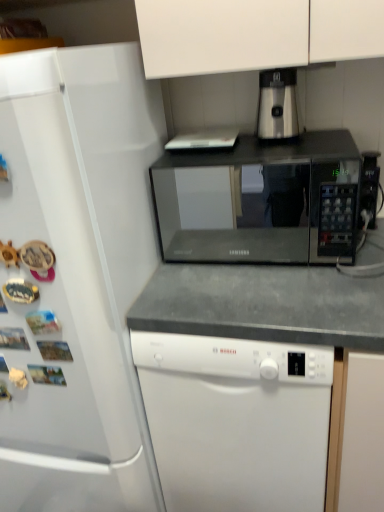
Measure the distance between point (268, 507) and camera.

1.12 meters.

In order to face satin silver coffee machine at upper center, should I rotate leftwards or rightwards?

You should rotate right by 11.264 degrees.

Locate an element on the screen. white glossy refrigerator at left is located at coordinates (78, 276).

Where is `black matte microwave at center`? black matte microwave at center is located at coordinates (261, 201).

This screenshot has width=384, height=512. I want to click on refrigerator on the left of black matte microwave at center, so click(x=78, y=276).

Is white glossy refrigerator at left at the back of black matte microwave at center?

No, black matte microwave at center is not facing the opposite direction of white glossy refrigerator at left.

From the picture: Which object is positioned more to the right, black matte microwave at center or white glossy refrigerator at left?

From the viewer's perspective, black matte microwave at center appears more on the right side.

Which object is closer to the camera taking this photo, black matte microwave at center or white glossy refrigerator at left?

white glossy refrigerator at left is in front.

Can you confirm if white matte dishwasher at center is smaller than white glossy refrigerator at left?

Yes.

Is white matte dishwasher at center further to camera compared to white glossy refrigerator at left?

Yes.

Considering the sizes of objects white matte dishwasher at center and white glossy refrigerator at left in the image provided, who is shorter, white matte dishwasher at center or white glossy refrigerator at left?

With less height is white matte dishwasher at center.

Which object is positioned more to the left, black matte microwave at center or white matte dishwasher at center?

black matte microwave at center is more to the left.

Considering the relative positions of black matte microwave at center and white matte dishwasher at center in the image provided, is black matte microwave at center behind white matte dishwasher at center?

Yes.

Based on the photo, from a real-world perspective, between black matte microwave at center and white matte dishwasher at center, who is vertically lower?

In real-world perspective, white matte dishwasher at center is lower.

Which object is positioned more to the right, black matte microwave at center or satin silver coffee machine at upper center?

satin silver coffee machine at upper center.

From the image's perspective, is black matte microwave at center above or below satin silver coffee machine at upper center?

Based on their image positions, black matte microwave at center is located beneath satin silver coffee machine at upper center.

Considering the relative sizes of black matte microwave at center and satin silver coffee machine at upper center in the image provided, is black matte microwave at center taller than satin silver coffee machine at upper center?

Yes, black matte microwave at center is taller than satin silver coffee machine at upper center.

Based on the photo, from a real-world perspective, is satin silver coffee machine at upper center positioned under black matte microwave at center based on gravity?

Actually, satin silver coffee machine at upper center is physically above black matte microwave at center in the real world.

Is satin silver coffee machine at upper center looking in the opposite direction of black matte microwave at center?

satin silver coffee machine at upper center is not turned away from black matte microwave at center.

Locate an element on the screen. This screenshot has width=384, height=512. coffee machine that appears behind the black matte microwave at center is located at coordinates (277, 105).

How many degrees apart are the facing directions of satin silver coffee machine at upper center and black matte microwave at center?

There is a 0.123-degree angle between the facing directions of satin silver coffee machine at upper center and black matte microwave at center.

Based on the photo, which point is more forward, (287,89) or (202,448)?

Positioned in front is point (287,89).

Is satin silver coffee machine at upper center taller or shorter than white matte dishwasher at center?

Clearly, satin silver coffee machine at upper center is shorter compared to white matte dishwasher at center.

Is satin silver coffee machine at upper center closer to the viewer compared to white matte dishwasher at center?

No, satin silver coffee machine at upper center is further to the viewer.

Is satin silver coffee machine at upper center not close to white matte dishwasher at center?

No, satin silver coffee machine at upper center is in close proximity to white matte dishwasher at center.

From the image's perspective, which is below, satin silver coffee machine at upper center or white glossy refrigerator at left?

white glossy refrigerator at left, from the image's perspective.

Is the surface of satin silver coffee machine at upper center in direct contact with white glossy refrigerator at left?

No, satin silver coffee machine at upper center is not next to white glossy refrigerator at left.

Find the location of `refrigerator on the left of satin silver coffee machine at upper center`. refrigerator on the left of satin silver coffee machine at upper center is located at coordinates (78, 276).

You are a GUI agent. You are given a task and a screenshot of the screen. Output one action in this format:
    pyautogui.click(x=<x>, y=<y>)
    Task: Click on the microwave oven positioned vertically above the white glossy refrigerator at left (from a real-world perspective)
    Image resolution: width=384 pixels, height=512 pixels.
    Given the screenshot: What is the action you would take?
    pyautogui.click(x=261, y=201)

The width and height of the screenshot is (384, 512). I want to click on refrigerator above the white matte dishwasher at center (from the image's perspective), so click(78, 276).

When comparing their distances from white glossy refrigerator at left, does white matte dishwasher at center or satin silver coffee machine at upper center seem closer?

white matte dishwasher at center is closer to white glossy refrigerator at left.

Based on their spatial positions, is white glossy refrigerator at left or black matte microwave at center further from white matte dishwasher at center?

The object further to white matte dishwasher at center is black matte microwave at center.

Considering their positions, is satin silver coffee machine at upper center positioned closer to white matte dishwasher at center than black matte microwave at center?

Among the two, satin silver coffee machine at upper center is located nearer to white matte dishwasher at center.

Considering their positions, is satin silver coffee machine at upper center positioned further to black matte microwave at center than white matte dishwasher at center?

white matte dishwasher at center.

Based on their spatial positions, is black matte microwave at center or white glossy refrigerator at left closer to white matte dishwasher at center?

white glossy refrigerator at left lies closer to white matte dishwasher at center than the other object.

From the image, which object appears to be farther from satin silver coffee machine at upper center, white matte dishwasher at center or black matte microwave at center?

Among the two, black matte microwave at center is located further to satin silver coffee machine at upper center.

When comparing their distances from white glossy refrigerator at left, does white matte dishwasher at center or black matte microwave at center seem further?

black matte microwave at center is further to white glossy refrigerator at left.

Considering their positions, is satin silver coffee machine at upper center positioned closer to white glossy refrigerator at left than black matte microwave at center?

satin silver coffee machine at upper center lies closer to white glossy refrigerator at left than the other object.

Where is `microwave oven located between white glossy refrigerator at left and white matte dishwasher at center in the left-right direction`? This screenshot has height=512, width=384. microwave oven located between white glossy refrigerator at left and white matte dishwasher at center in the left-right direction is located at coordinates (261, 201).

Locate an element on the screen. The image size is (384, 512). microwave oven between white glossy refrigerator at left and satin silver coffee machine at upper center is located at coordinates (261, 201).

The height and width of the screenshot is (512, 384). In order to click on refrigerator that lies between satin silver coffee machine at upper center and white matte dishwasher at center from top to bottom in this screenshot , I will do `click(78, 276)`.

At what (x,y) coordinates should I click in order to perform the action: click on microwave oven between satin silver coffee machine at upper center and white matte dishwasher at center in the vertical direction. Please return your answer as a coordinate pair (x, y). Looking at the image, I should click on (261, 201).